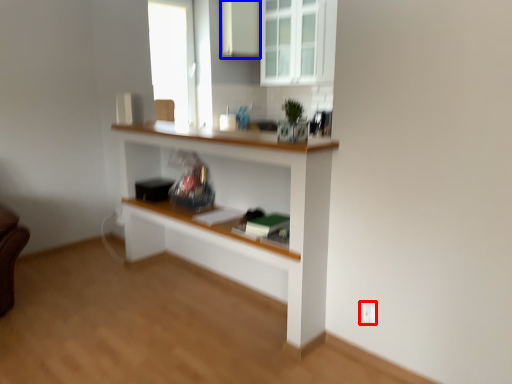
Question: Which point is closer to the camera, electric outlet (highlighted by a red box) or cabinetry (highlighted by a blue box)?

Choices:
 (A) electric outlet
 (B) cabinetry

Answer: (A)